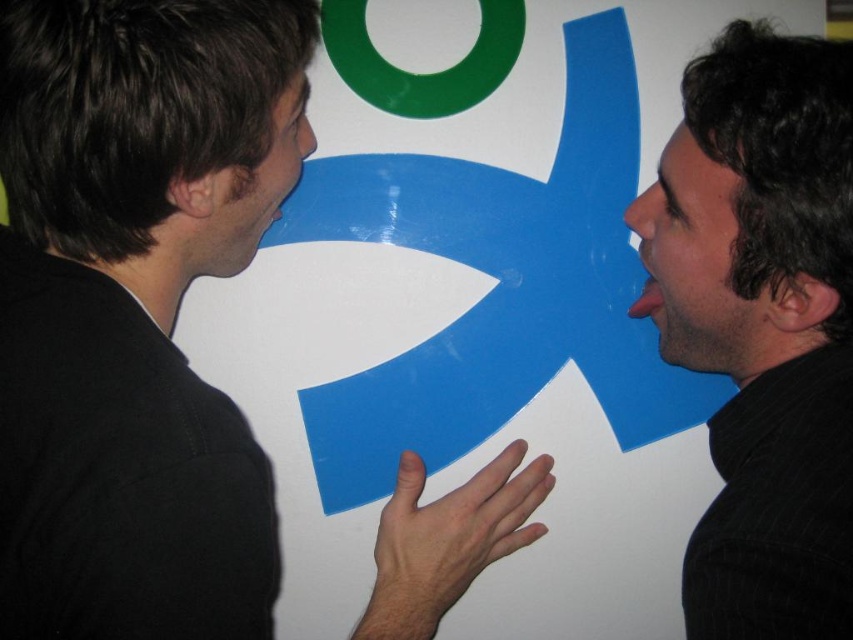
Who is shorter, black matte shirt at left or black textured hair at right?

Standing shorter between the two is black textured hair at right.

Does black matte shirt at left have a greater height compared to black textured hair at right?

Yes, black matte shirt at left is taller than black textured hair at right.

Is point (76, 118) positioned behind point (704, 182)?

No, (76, 118) is closer to viewer.

The height and width of the screenshot is (640, 853). Find the location of `black matte shirt at left`. black matte shirt at left is located at coordinates (135, 308).